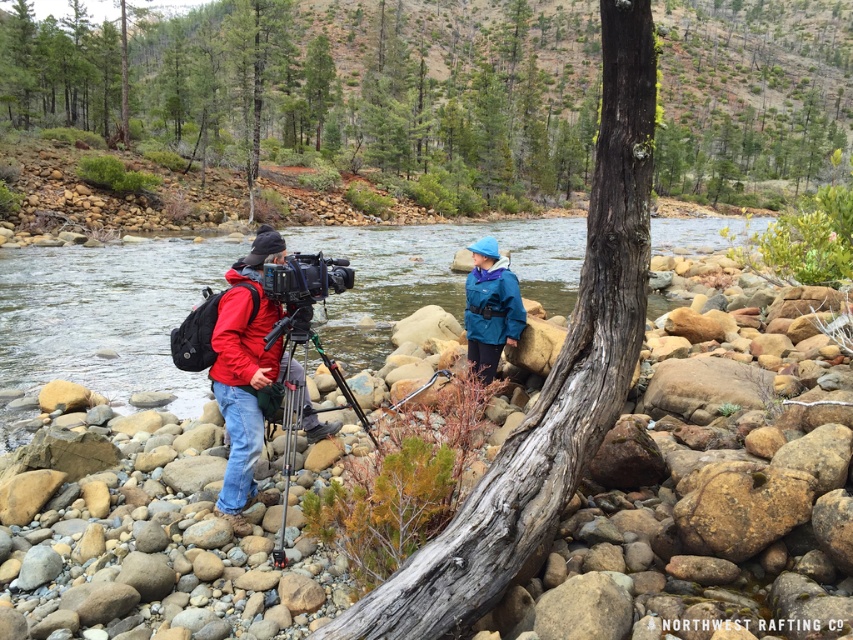
Question: Among these objects, which one is nearest to the camera?

Choices:
 (A) matte black video camera at center
 (B) teal waterproof jacket at center
 (C) silver metallic tripod at center
 (D) clear water at stream left

Answer: (C)

Question: Which point is farther from the camera taking this photo?

Choices:
 (A) (312, 412)
 (B) (347, 282)
 (C) (436, 112)
 (D) (431, 545)

Answer: (C)

Question: Is clear water at stream left wider than brown rough bark tree trunk at center?

Choices:
 (A) no
 (B) yes

Answer: (B)

Question: Does brown rough bark tree trunk at center lie in front of silver metallic tripod at center?

Choices:
 (A) yes
 (B) no

Answer: (A)

Question: Is teal waterproof jacket at center above silver metallic tripod at center?

Choices:
 (A) no
 (B) yes

Answer: (B)

Question: Which object is the farthest from the brown rough bark tree trunk at center?

Choices:
 (A) matte black video camera at center
 (B) smooth bark tree at center
 (C) clear water at stream left

Answer: (B)